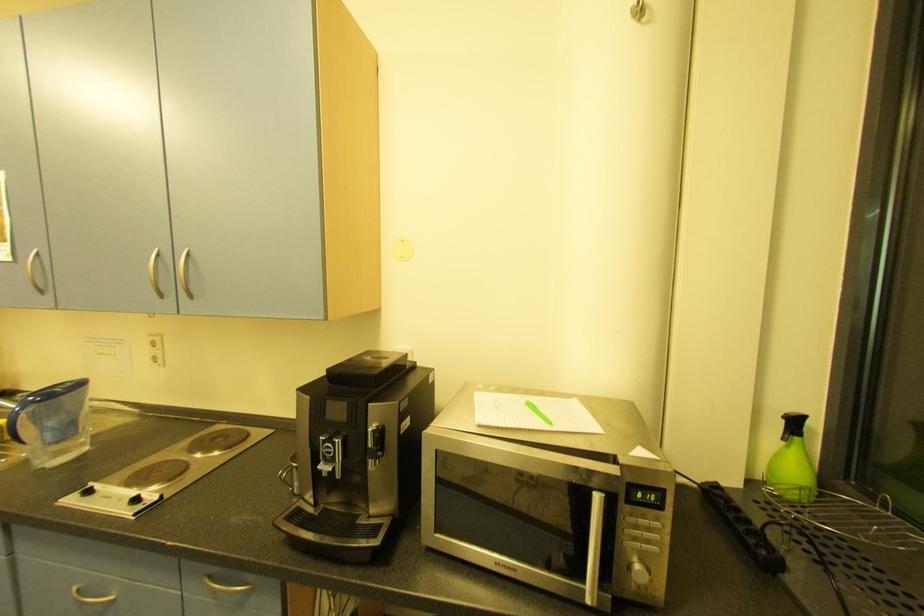
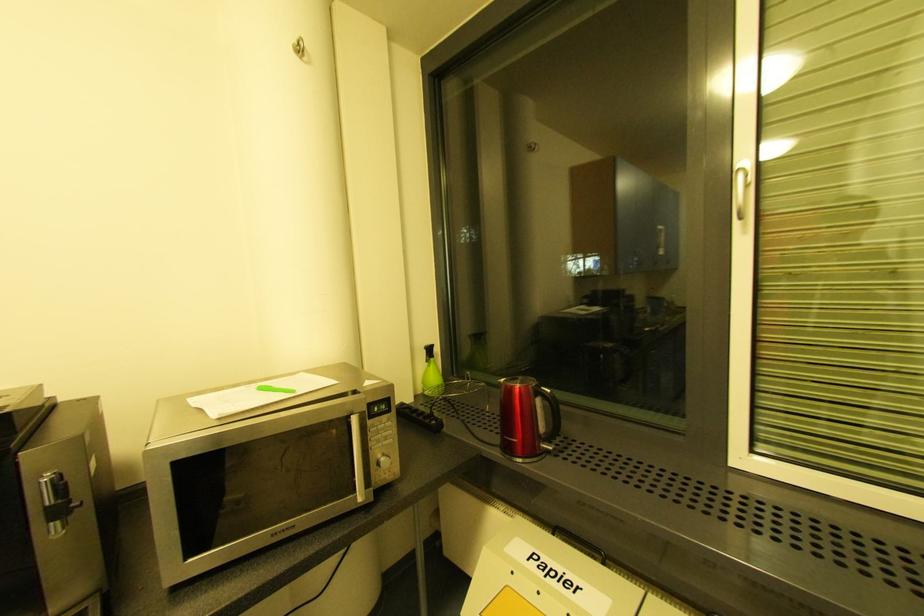
Question: The camera is either moving clockwise (left) or counter-clockwise (right) around the object. The first image is from the beginning of the video and the second image is from the end. Is the camera moving left or right when shooting the video?

Choices:
 (A) Left
 (B) Right

Answer: (A)